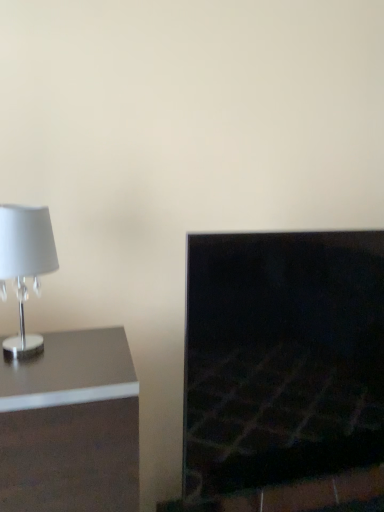
This screenshot has width=384, height=512. I want to click on vacant space to the right of white glossy lampshade at left, so click(99, 359).